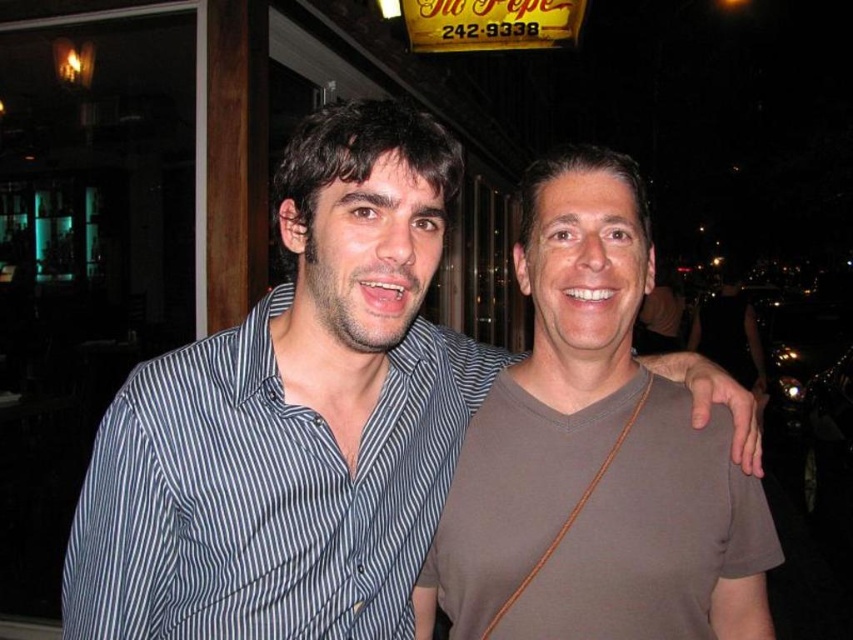
Who is positioned more to the left, striped cotton shirt at center or brown matte shirt at center?

striped cotton shirt at center is more to the left.

Is striped cotton shirt at center taller than brown matte shirt at center?

No.

Is point (439, 208) less distant than point (634, 529)?

Yes, it is.

Find the location of `striped cotton shirt at center`. striped cotton shirt at center is located at coordinates coord(293,419).